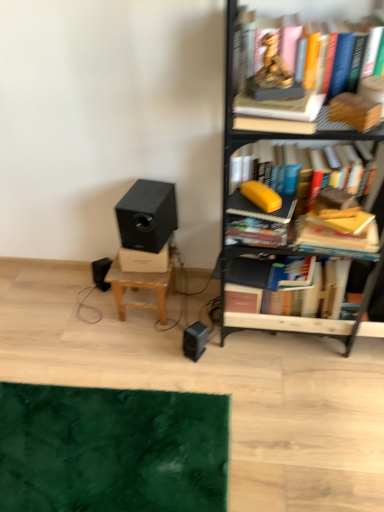
The image size is (384, 512). In order to click on vacant area that lies between metallic black bookcase at right and black plastic speaker at lower center in this screenshot , I will do `click(243, 346)`.